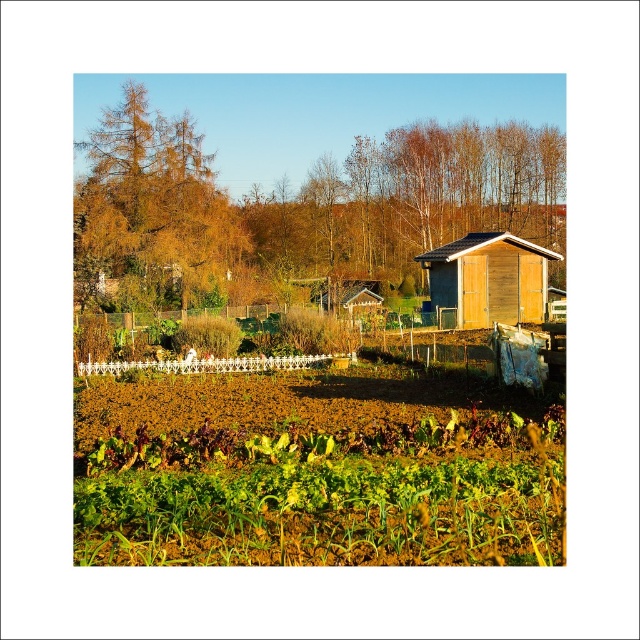
You are standing at the center of the garden looking towards the shed. Where would you find the green leafy vegetables at lower center relative to your position?

The green leafy vegetables at lower center are located at the lower center of the image, which would be directly in front of you at the bottom part of the garden area.

You are standing in the rural garden scene and want to determine the relative positions of two points marked in the image. Which point, point (77, 506) or point (483, 304), is closer to your current position?

Point (77, 506) is closer to the camera than point (483, 304), so it is closer to your current position.